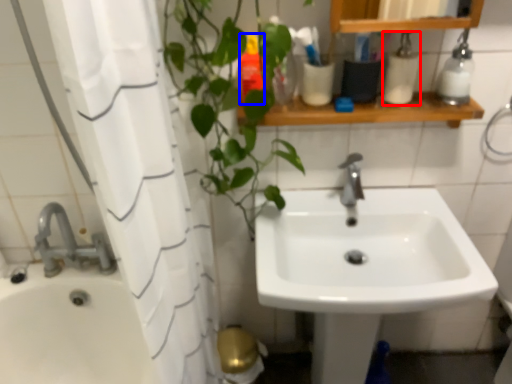
Question: Which point is further to the camera, toiletry (highlighted by a red box) or toiletry (highlighted by a blue box)?

Choices:
 (A) toiletry
 (B) toiletry

Answer: (B)